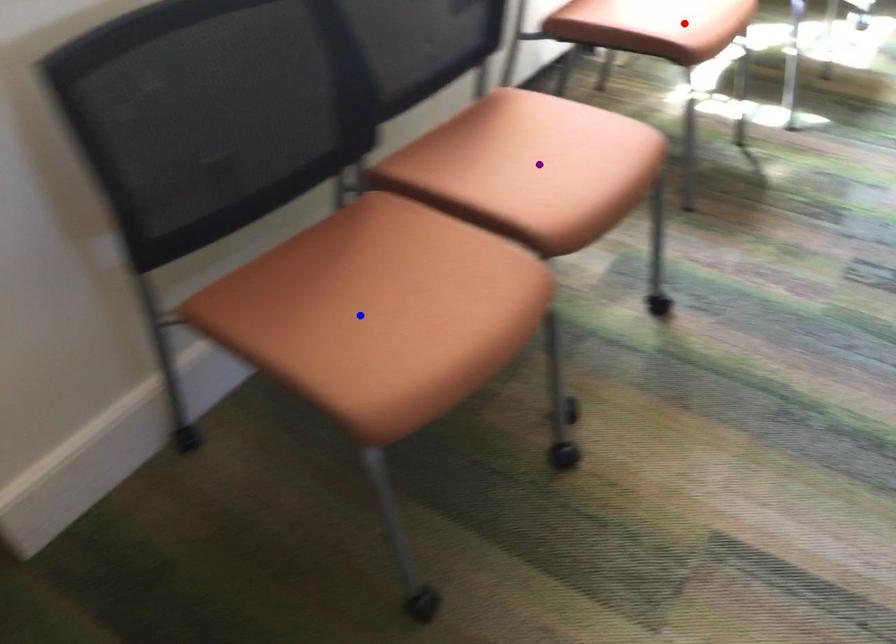
Based on the photo, order these from nearest to farthest:
A) purple point
B) blue point
C) red point

blue point
purple point
red point